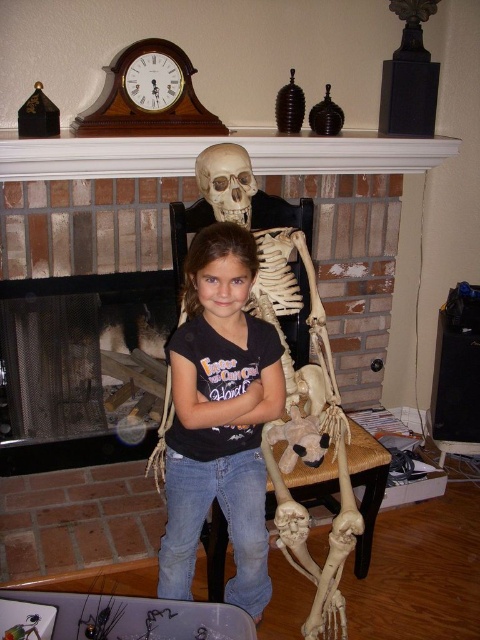
Question: Where is brick fireplace at center located in relation to matte black shirt at center in the image?

Choices:
 (A) below
 (B) above

Answer: (B)

Question: Among these points, which one is nearest to the camera?

Choices:
 (A) (244, 392)
 (B) (307, 147)
 (C) (206, 193)

Answer: (A)

Question: In this image, where is matte black shirt at center located relative to matte plastic skull at upper center?

Choices:
 (A) right
 (B) left

Answer: (B)

Question: Which point appears farthest from the camera in this image?

Choices:
 (A) (231, 218)
 (B) (213, 344)
 (C) (0, 160)

Answer: (C)

Question: Does brick fireplace at center have a lesser width compared to matte black shirt at center?

Choices:
 (A) yes
 (B) no

Answer: (B)

Question: Considering the real-world distances, which object is farthest from the matte plastic skull at upper center?

Choices:
 (A) matte black shirt at center
 (B) brick fireplace at center

Answer: (B)